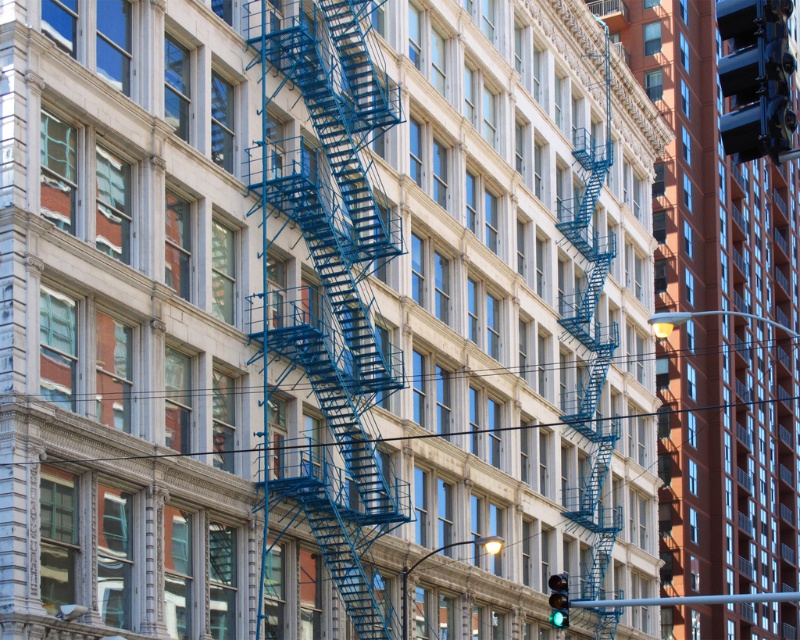
In the scene shown: You are a delivery person trying to navigate through the narrow alley between the blue metal fire escape at center and the metallic gray pole at center. The delivery cart you are pushing is 1.2 meters wide. Can you pass through the space between them without touching either?

The blue metal fire escape at center might be wider than the metallic gray pole at center, but without exact measurements, it is uncertain if the space between them is wide enough for your 1.2 meter cart. Proceed with caution or seek an alternative route.

You are a pedestrian standing in front of the building and want to cross the street. You notice a metallic blue traffic light at upper right and a metallic gray pole at center. Which object is located to the right of the other?

The metallic blue traffic light at upper right is positioned on the right side of the metallic gray pole at center.

You are a delivery person trying to navigate through the city. You see the metallic blue traffic light at upper right and the metallic gray pole at center. Which object is positioned higher in the scene?

The metallic blue traffic light at upper right is above the metallic gray pole at center, so it is positioned higher in the scene.